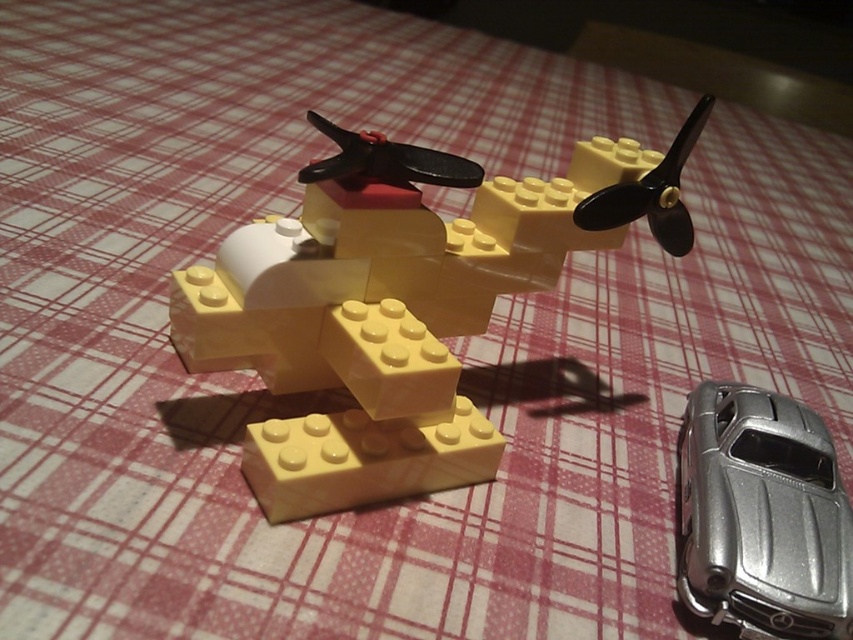
You are a toy collector who wants to place both the yellow matte airplane at center and the silver metallic car at lower right on a shelf. The shelf has a height limit of 10 cm. Can you fit both items on the shelf without exceeding the height limit?

The yellow matte airplane at center is above the silver metallic car at lower right, so the airplane is taller. Since the shelf has a height limit of 10 cm, you need to ensure the airplane does not exceed this. However, the exact height of the airplane is not provided, so it is uncertain if it will fit within the 10 cm limit.

You are looking at the LEGO biplane and the silver toy car in the image. Which of the two points, point (418,474) or point (843,508), is closer to you?

Point (418,474) is closer to the camera than point (843,508).